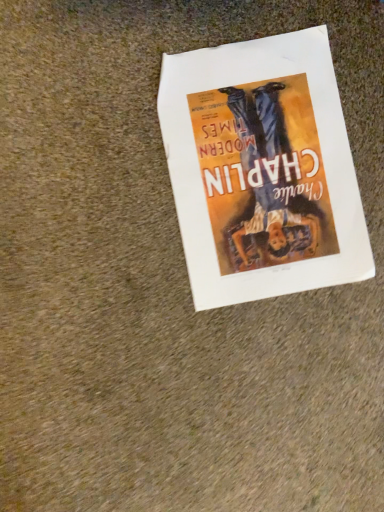
At what (x,y) coordinates should I click in order to perform the action: click on free spot above matte paper poster at center (from a real-world perspective). Please return your answer as a coordinate pair (x, y). This screenshot has width=384, height=512. Looking at the image, I should click on (266, 151).